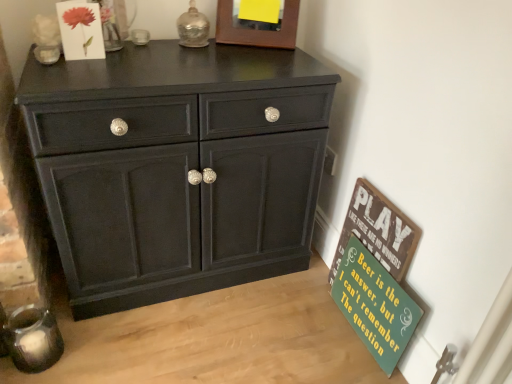
This screenshot has height=384, width=512. What are the coordinates of `empty space that is ontop of green wood signboard at lower right, the second bulletin board positioned from the top` in the screenshot? It's located at (385, 248).